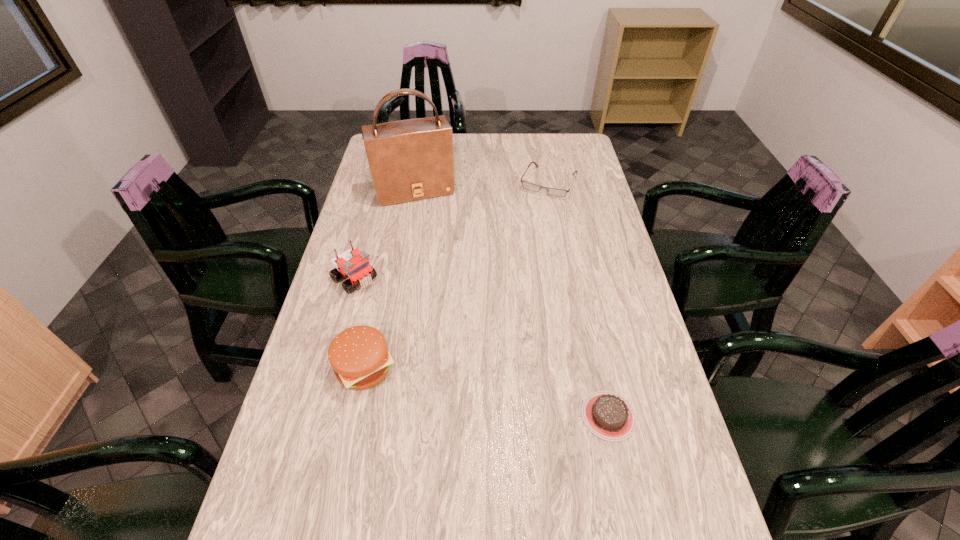
The image size is (960, 540). Find the location of `free spot on the desktop that is between the hamburger and the shortest object and is positioned on the front flap of the tallest object`. free spot on the desktop that is between the hamburger and the shortest object and is positioned on the front flap of the tallest object is located at coordinates (480, 391).

The image size is (960, 540). In order to click on vacant space on the desktop that is between the third tallest object and the shortest object and is positioned on the front-facing side of the fourth shortest object in this screenshot , I will do `click(489, 393)`.

The width and height of the screenshot is (960, 540). Identify the location of vacant space on the desktop that is between the hamburger and the chocolate cake and is positioned on the front-facing side of the spectacles. (445, 384).